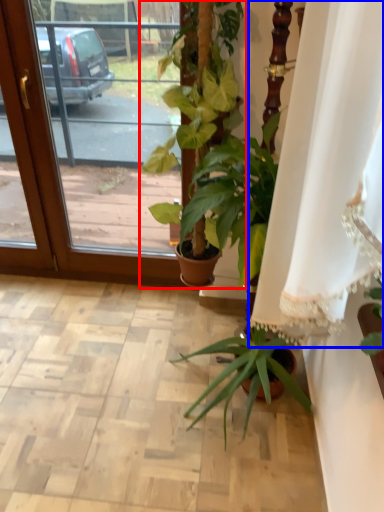
Question: Which of the following is the farthest to the observer, houseplant (highlighted by a red box) or curtain (highlighted by a blue box)?

Choices:
 (A) houseplant
 (B) curtain

Answer: (A)